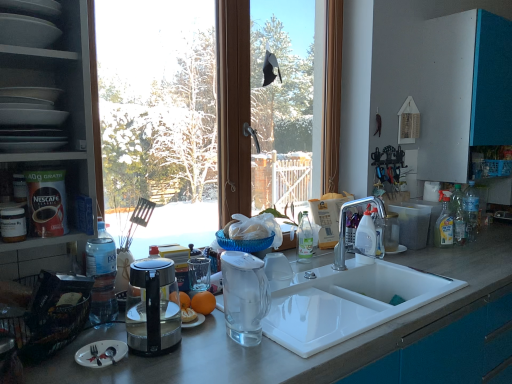
Question: Considering the relative sizes of silver matte fork at lower left and matte white plates at left, the second shelf in the top-to-bottom sequence, in the image provided, is silver matte fork at lower left taller than matte white plates at left, the second shelf in the top-to-bottom sequence,?

Choices:
 (A) no
 (B) yes

Answer: (A)

Question: From a real-world perspective, does silver matte fork at lower left sit lower than matte white plates at left, the second shelf in the top-to-bottom sequence?

Choices:
 (A) no
 (B) yes

Answer: (B)

Question: Is there a large distance between silver matte fork at lower left and matte white plates at left, the second shelf in the top-to-bottom sequence?

Choices:
 (A) no
 (B) yes

Answer: (A)

Question: Is silver matte fork at lower left thinner than matte white plates at left, positioned as the 1th shelf in bottom-to-top order?

Choices:
 (A) no
 (B) yes

Answer: (B)

Question: From a real-world perspective, is silver matte fork at lower left on top of matte white plates at left, the second shelf in the top-to-bottom sequence?

Choices:
 (A) yes
 (B) no

Answer: (B)

Question: Considering their positions, is transparent glass blender at sink located in front of or behind smooth gray countertop at center?

Choices:
 (A) behind
 (B) front

Answer: (A)

Question: Choose the correct answer: Is transparent glass blender at sink inside smooth gray countertop at center or outside it?

Choices:
 (A) inside
 (B) outside

Answer: (B)

Question: Looking at the image, does transparent glass blender at sink seem bigger or smaller compared to smooth gray countertop at center?

Choices:
 (A) small
 (B) big

Answer: (A)

Question: From the image's perspective, is transparent glass blender at sink located above or below smooth gray countertop at center?

Choices:
 (A) below
 (B) above

Answer: (B)

Question: Is point (71, 56) positioned closer to the camera than point (77, 89)?

Choices:
 (A) farther
 (B) closer

Answer: (A)

Question: Is matte gray plates at upper left, which is the 1th shelf from top to bottom, situated inside matte white plates at left, positioned as the 1th shelf in bottom-to-top order, or outside?

Choices:
 (A) inside
 (B) outside

Answer: (B)

Question: In the image, is matte gray plates at upper left, which is the 1th shelf from top to bottom, on the left side or the right side of matte white plates at left, positioned as the 1th shelf in bottom-to-top order?

Choices:
 (A) left
 (B) right

Answer: (B)

Question: From the image's perspective, is matte gray plates at upper left, arranged as the 2th shelf when ordered from the bottom, positioned above or below matte white plates at left, the second shelf in the top-to-bottom sequence?

Choices:
 (A) above
 (B) below

Answer: (A)

Question: In terms of height, does silver matte fork at lower left look taller or shorter compared to matte gray plates at upper left, arranged as the 2th shelf when ordered from the bottom?

Choices:
 (A) tall
 (B) short

Answer: (B)

Question: From a real-world perspective, is silver matte fork at lower left positioned above or below matte gray plates at upper left, arranged as the 2th shelf when ordered from the bottom?

Choices:
 (A) below
 (B) above

Answer: (A)